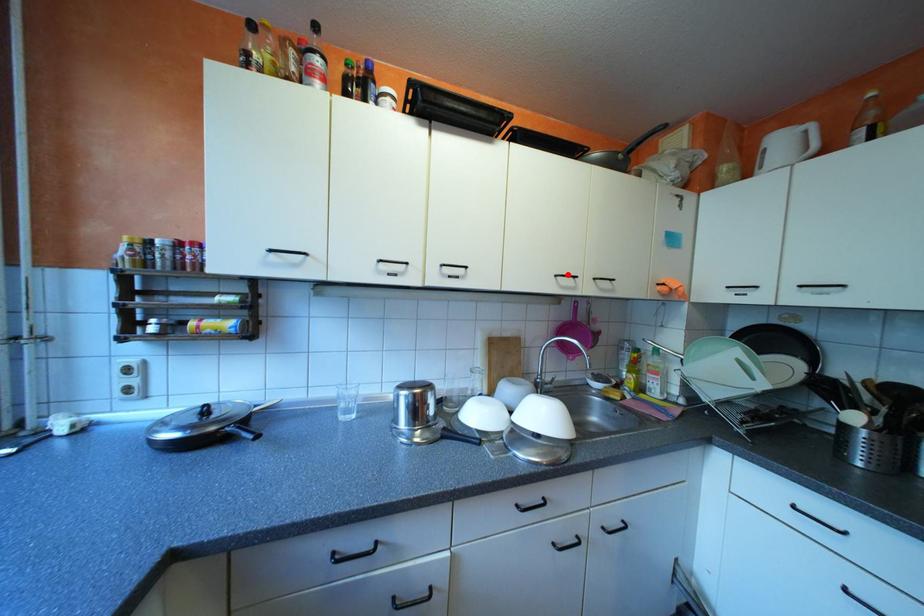
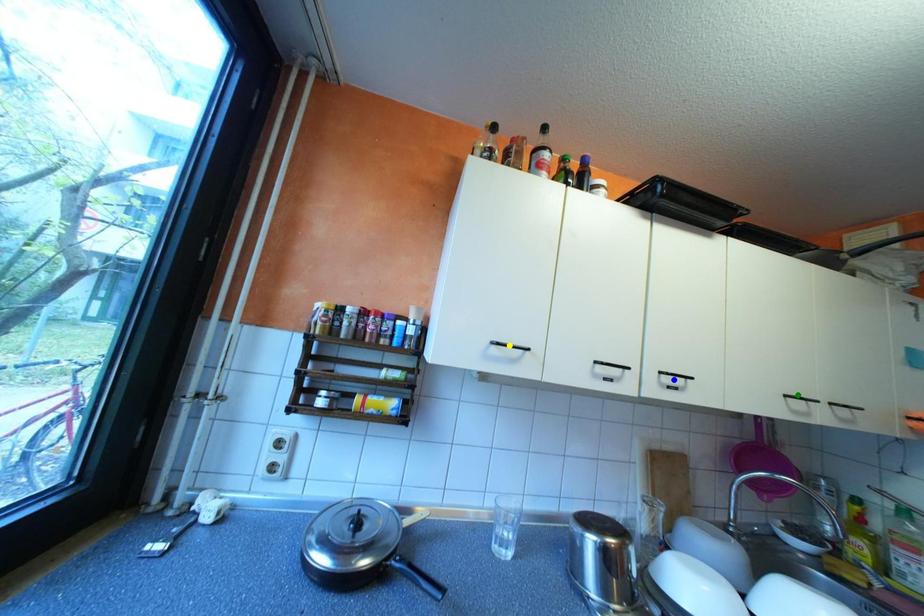
Question: I am providing you with two images of the same scene from different viewpoints. A red point is marked on the first image. You are given multiple points on the second image. Which point in image 2 is actually the same real-world point as the red point in image 1?

Choices:
 (A) blue point
 (B) yellow point
 (C) green point

Answer: (C)